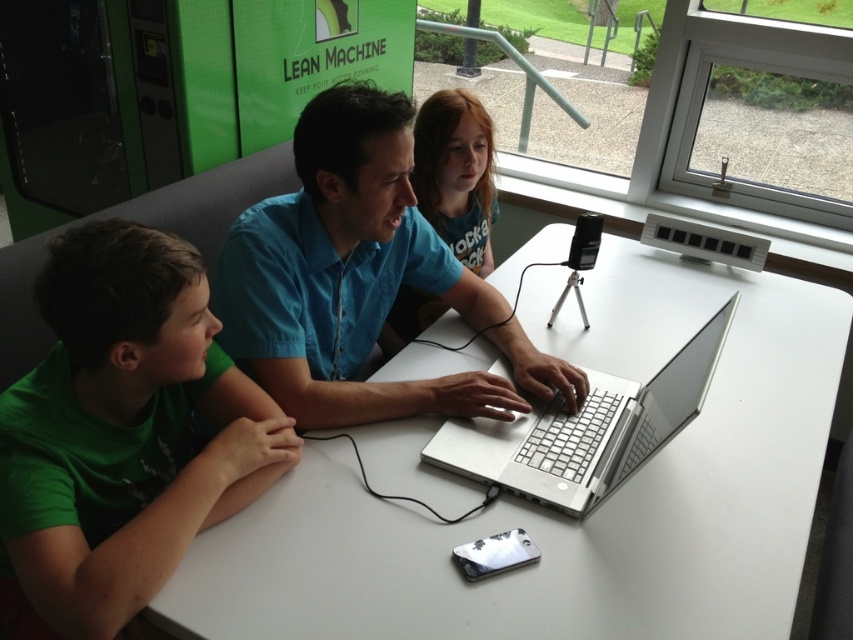
Question: Which is nearer to the white matte table at center?

Choices:
 (A) green matte shirt at left
 (B) matte blue shirt at center

Answer: (A)

Question: Based on their relative distances, which object is nearer to the matte blue shirt at center?

Choices:
 (A) white matte table at center
 (B) silver metallic laptop at center

Answer: (A)

Question: Can you confirm if blue matte shirt at center is positioned above matte blue shirt at center?

Choices:
 (A) no
 (B) yes

Answer: (A)

Question: Where is silver metallic laptop at center located in relation to matte blue shirt at center in the image?

Choices:
 (A) right
 (B) left

Answer: (A)

Question: Does white matte table at center appear over silver metallic laptop at center?

Choices:
 (A) yes
 (B) no

Answer: (A)

Question: Which object is positioned closest to the blue matte shirt at center?

Choices:
 (A) white matte table at center
 (B) matte blue shirt at center

Answer: (A)